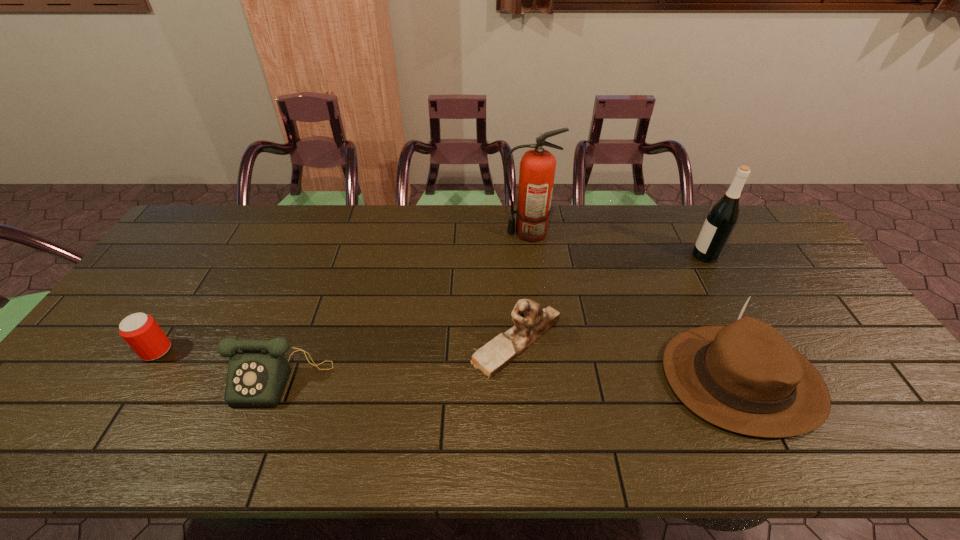
You are a GUI agent. You are given a task and a screenshot of the screen. Output one action in this format:
    pyautogui.click(x=<x>, y=<y>)
    Task: Click on the free space located 0.230m on the nozzle of the farthest object
    
    Given the screenshot: What is the action you would take?
    [x=434, y=233]

You are a GUI agent. You are given a task and a screenshot of the screen. Output one action in this format:
    pyautogui.click(x=<x>, y=<y>)
    Task: Click on the vacant space located on the label of the wine bottle
    Image resolution: width=960 pixels, height=540 pixels.
    Given the screenshot: What is the action you would take?
    pyautogui.click(x=640, y=255)

In order to click on vacant space located 0.190m on the label of the wine bottle in this screenshot , I will do `click(635, 255)`.

Identify the location of blank area located on the label of the wine bottle. (591, 255).

Find the location of `blank space located 0.190m on the feather side of the fedora`. blank space located 0.190m on the feather side of the fedora is located at coordinates (588, 379).

This screenshot has width=960, height=540. Find the location of `free location located 0.360m on the feather side of the fedora`. free location located 0.360m on the feather side of the fedora is located at coordinates (520, 379).

Locate an element on the screen. free space located 0.290m on the feather side of the fedora is located at coordinates (548, 379).

Image resolution: width=960 pixels, height=540 pixels. In order to click on vacant space situated 0.310m on the front-facing side of the fourth tallest object in this screenshot , I will do `click(355, 342)`.

Find the location of a particular element. vacant space situated 0.320m on the front-facing side of the fourth tallest object is located at coordinates (351, 342).

You are a GUI agent. You are given a task and a screenshot of the screen. Output one action in this format:
    pyautogui.click(x=<x>, y=<y>)
    Task: Click on the vacant region located on the front-facing side of the fourth tallest object
    
    Given the screenshot: What is the action you would take?
    [x=433, y=342]